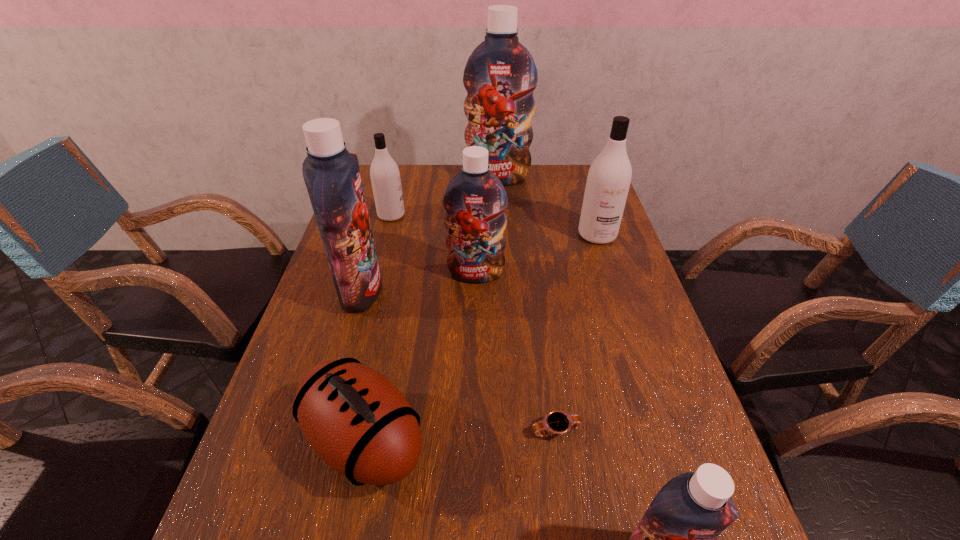
Locate an element on the screen. blank region between the second biggest blue shampoo and the shortest object is located at coordinates 459,361.

Select which object appears as the sixth closest to the smallest blue shampoo. Please provide its 2D coordinates. Your answer should be formatted as a tuple, i.e. [(x, y)], where the tuple contains the x and y coordinates of a point satisfying the conditions above.

[(385, 176)]

Point out which object is positioned as the nearest to the nearer white shampoo. Please provide its 2D coordinates. Your answer should be formatted as a tuple, i.e. [(x, y)], where the tuple contains the x and y coordinates of a point satisfying the conditions above.

[(475, 199)]

You are a GUI agent. You are given a task and a screenshot of the screen. Output one action in this format:
    pyautogui.click(x=<x>, y=<y>)
    Task: Click on the shampoo that is the closest to the seventh nearest object
    This screenshot has height=540, width=960.
    Given the screenshot: What is the action you would take?
    click(x=332, y=175)

The image size is (960, 540). What are the coordinates of `shampoo that is the second closest to the fifth shortest shampoo` in the screenshot? It's located at (385, 176).

Identify the location of blue shampoo that stands as the second closest to the leftmost blue shampoo. (500, 75).

Where is `blue shampoo that is the closest to the leftmost blue shampoo`? This screenshot has width=960, height=540. blue shampoo that is the closest to the leftmost blue shampoo is located at coordinates (475, 199).

The image size is (960, 540). Identify the location of vacant space that satisfies the following two spatial constraints: 1. on the front-facing side of the shortest object; 2. on the left side of the seventh nearest object. (334, 431).

Locate an element on the screen. This screenshot has width=960, height=540. vacant area that satisfies the following two spatial constraints: 1. on the front label of the seventh shortest object; 2. on the right side of the watch is located at coordinates (321, 431).

This screenshot has width=960, height=540. I want to click on free spot that satisfies the following two spatial constraints: 1. on the front-facing side of the right white shampoo; 2. on the front label of the third smallest blue shampoo, so point(615,291).